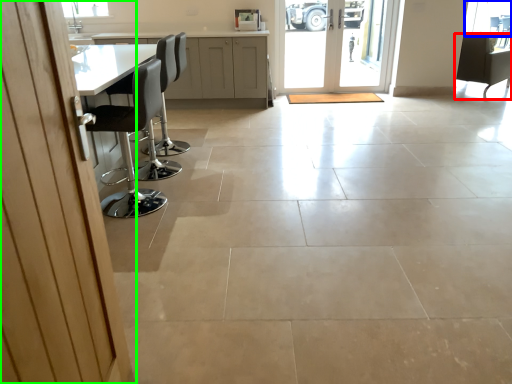
Question: Which object is the closest to the chair (highlighted by a red box)? Choose among these: window screen (highlighted by a blue box) or door (highlighted by a green box).

Choices:
 (A) window screen
 (B) door

Answer: (A)